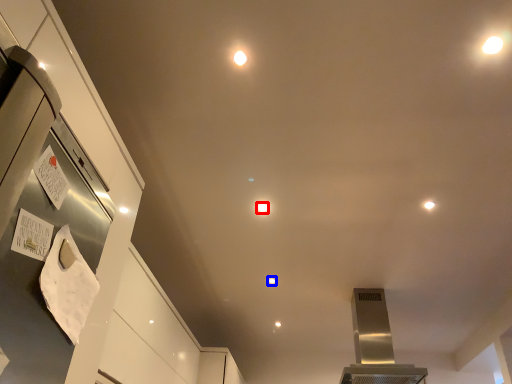
Question: Which object is closer to the camera taking this photo, light (highlighted by a red box) or light (highlighted by a blue box)?

Choices:
 (A) light
 (B) light

Answer: (A)